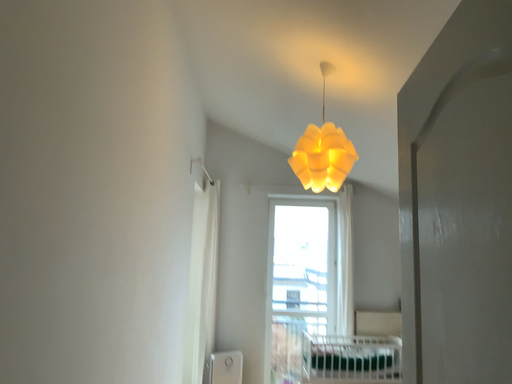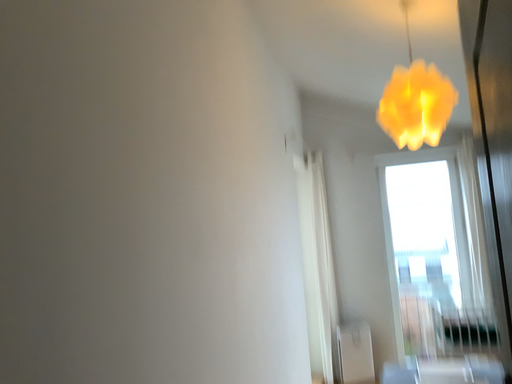
Question: Which way did the camera rotate in the video?

Choices:
 (A) rotated left
 (B) rotated right

Answer: (A)